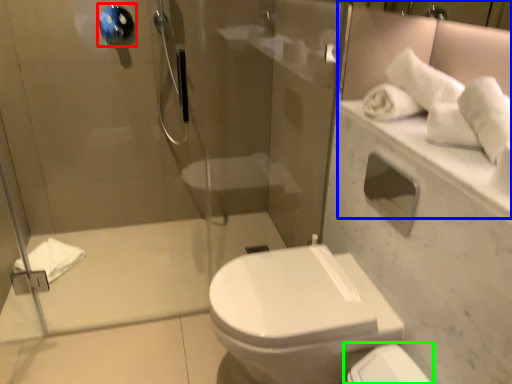
Question: Estimate the real-world distances between objects in this image. Which object is closer to towel bar (highlighted by a red box), mirror (highlighted by a blue box) or toilet (highlighted by a green box)?

Choices:
 (A) mirror
 (B) toilet

Answer: (A)